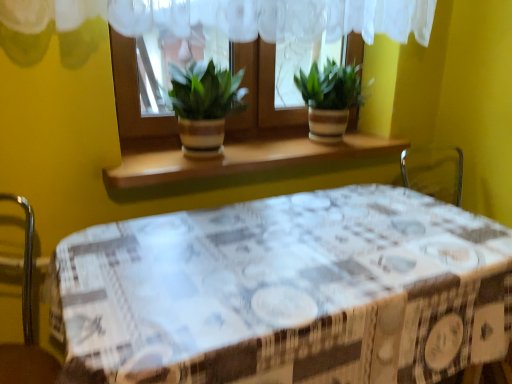
Question: Can you confirm if green leafy plant at center is taller than matte brown pot at center, marked as the 1th houseplant in a left-to-right arrangement?

Choices:
 (A) yes
 (B) no

Answer: (A)

Question: Is green leafy plant at center closer to camera compared to matte brown pot at center, the second houseplant viewed from the right?

Choices:
 (A) no
 (B) yes

Answer: (A)

Question: Is green leafy plant at center positioned behind matte brown pot at center, the second houseplant viewed from the right?

Choices:
 (A) yes
 (B) no

Answer: (A)

Question: Is green leafy plant at center shorter than matte brown pot at center, marked as the 1th houseplant in a left-to-right arrangement?

Choices:
 (A) yes
 (B) no

Answer: (B)

Question: Is green leafy plant at center not close to matte brown pot at center, marked as the 1th houseplant in a left-to-right arrangement?

Choices:
 (A) yes
 (B) no

Answer: (B)

Question: Based on their sizes in the image, would you say green striped pot at center, which is the second houseplant in left-to-right order, is bigger or smaller than matte brown pot at center, marked as the 1th houseplant in a left-to-right arrangement?

Choices:
 (A) big
 (B) small

Answer: (A)

Question: Considering the positions of green striped pot at center, which is the second houseplant in left-to-right order, and matte brown pot at center, the second houseplant viewed from the right, in the image, is green striped pot at center, which is the second houseplant in left-to-right order, taller or shorter than matte brown pot at center, the second houseplant viewed from the right,?

Choices:
 (A) tall
 (B) short

Answer: (B)

Question: Choose the correct answer: Is green striped pot at center, which is the second houseplant in left-to-right order, inside matte brown pot at center, the second houseplant viewed from the right, or outside it?

Choices:
 (A) inside
 (B) outside

Answer: (B)

Question: Considering their positions, is green striped pot at center, which ranks as the 1th houseplant in right-to-left order, located in front of or behind matte brown pot at center, marked as the 1th houseplant in a left-to-right arrangement?

Choices:
 (A) front
 (B) behind

Answer: (B)

Question: Would you say green striped pot at center, which ranks as the 1th houseplant in right-to-left order, is to the left or to the right of green leafy plant at center in the picture?

Choices:
 (A) left
 (B) right

Answer: (B)

Question: In the image, is green striped pot at center, which ranks as the 1th houseplant in right-to-left order, positioned in front of or behind green leafy plant at center?

Choices:
 (A) behind
 (B) front

Answer: (A)

Question: From the image's perspective, relative to green leafy plant at center, is green striped pot at center, which is the second houseplant in left-to-right order, above or below?

Choices:
 (A) below
 (B) above

Answer: (A)

Question: From a real-world perspective, is green striped pot at center, which is the second houseplant in left-to-right order, physically located above or below green leafy plant at center?

Choices:
 (A) above
 (B) below

Answer: (B)

Question: Considering their positions, is green leafy plant at center located in front of or behind matte brown pot at center, the second houseplant viewed from the right?

Choices:
 (A) behind
 (B) front

Answer: (A)

Question: From the image's perspective, is green leafy plant at center positioned above or below matte brown pot at center, the second houseplant viewed from the right?

Choices:
 (A) above
 (B) below

Answer: (A)